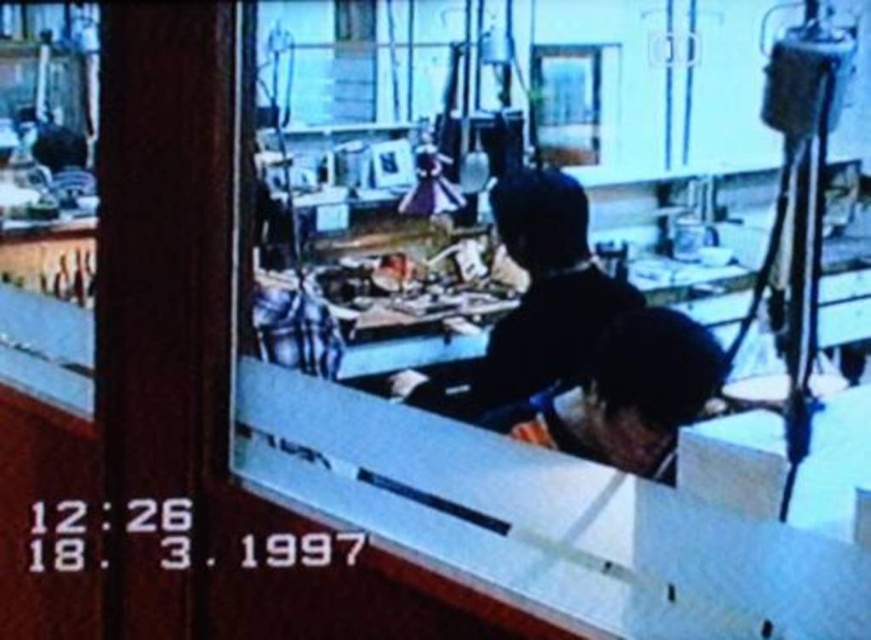
Based on the security camera footage, where is the black matte jacket at center positioned in relation to the timestamp located at the bottom left corner?

The black matte jacket at center is positioned to the right of the timestamp located at the bottom left corner since its coordinates are at point 0.452 on the x and 0.628 on the y, which places it right and above the timestamp.

In the scene shown: You are navigating through the workshop and need to reach a tool located at point (x=640, y=456). There is an obstacle at point (x=531, y=252). Will you encounter the obstacle before reaching the tool?

Point (x=531, y=252) is behind point (x=640, y=456), so you will not encounter the obstacle before reaching the tool.

In the security camera footage, you see a person wearing a black matte jacket at center and a black matte helmet at center. Which object is positioned to the left?

The black matte jacket at center is to the left of the black matte helmet at center.